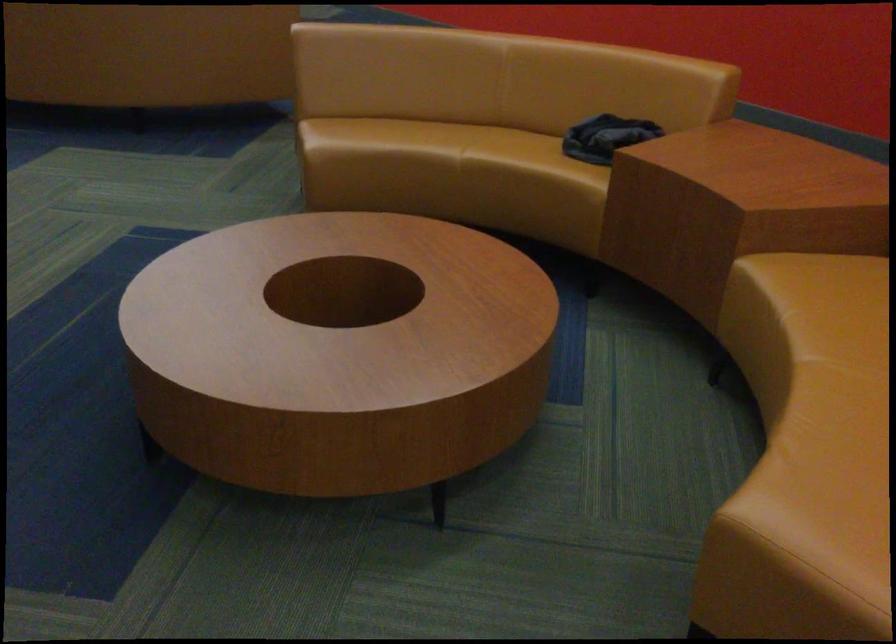
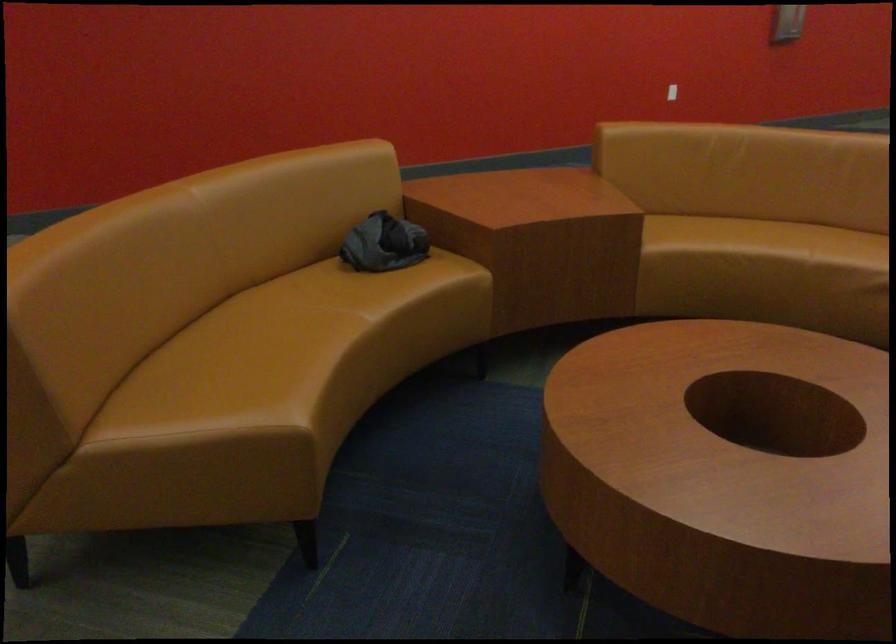
Where in the second image is the point corresponding to the point at 435,136 from the first image?

(271, 336)